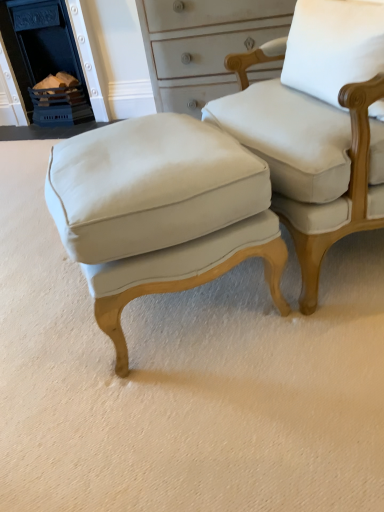
Question: Does blue painted brick fireplace at upper left have a larger size compared to white fabric pillow at upper right?

Choices:
 (A) yes
 (B) no

Answer: (A)

Question: Is blue painted brick fireplace at upper left in contact with white fabric pillow at upper right?

Choices:
 (A) yes
 (B) no

Answer: (B)

Question: Is blue painted brick fireplace at upper left at the left side of white fabric pillow at upper right?

Choices:
 (A) yes
 (B) no

Answer: (A)

Question: From a real-world perspective, is blue painted brick fireplace at upper left beneath white fabric pillow at upper right?

Choices:
 (A) no
 (B) yes

Answer: (B)

Question: Is blue painted brick fireplace at upper left at the right side of white fabric pillow at upper right?

Choices:
 (A) yes
 (B) no

Answer: (B)

Question: In terms of size, does white fabric pillow at upper right appear bigger or smaller than matte white fabric chair at center?

Choices:
 (A) small
 (B) big

Answer: (A)

Question: Is white fabric pillow at upper right spatially inside matte white fabric chair at center, or outside of it?

Choices:
 (A) inside
 (B) outside

Answer: (A)

Question: From the image's perspective, is white fabric pillow at upper right positioned above or below matte white fabric chair at center?

Choices:
 (A) above
 (B) below

Answer: (A)

Question: Visually, is white fabric pillow at upper right positioned to the left or to the right of matte white fabric chair at center?

Choices:
 (A) right
 (B) left

Answer: (B)

Question: Is point (182, 237) positioned closer to the camera than point (46, 72)?

Choices:
 (A) farther
 (B) closer

Answer: (B)

Question: Is matte white stool at center in front of or behind blue painted brick fireplace at upper left in the image?

Choices:
 (A) behind
 (B) front

Answer: (B)

Question: From a real-world perspective, relative to blue painted brick fireplace at upper left, is matte white stool at center vertically above or below?

Choices:
 (A) above
 (B) below

Answer: (B)

Question: Considering the relative positions of matte white stool at center and blue painted brick fireplace at upper left in the image provided, is matte white stool at center to the left or to the right of blue painted brick fireplace at upper left?

Choices:
 (A) left
 (B) right

Answer: (B)

Question: From the image's perspective, relative to blue painted brick fireplace at upper left, is white fabric pillow at upper right above or below?

Choices:
 (A) below
 (B) above

Answer: (A)

Question: Relative to blue painted brick fireplace at upper left, is white fabric pillow at upper right in front or behind?

Choices:
 (A) behind
 (B) front

Answer: (B)